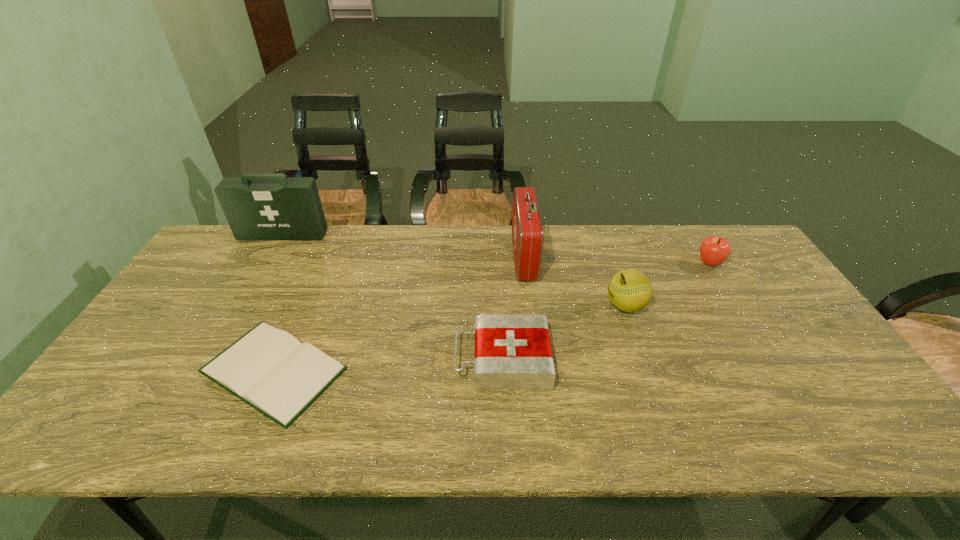
You are a GUI agent. You are given a task and a screenshot of the screen. Output one action in this format:
    pyautogui.click(x=<x>, y=<y>)
    Task: Click on the leftmost first-aid kit
    The height and width of the screenshot is (540, 960).
    Given the screenshot: What is the action you would take?
    point(258,206)

The image size is (960, 540). I want to click on softball, so click(629, 290).

At what (x,y) coordinates should I click in order to perform the action: click on the second object from right to left. Please return your answer as a coordinate pair (x, y). This screenshot has height=540, width=960. Looking at the image, I should click on (629, 290).

Locate an element on the screen. The height and width of the screenshot is (540, 960). the rightmost object is located at coordinates (714, 250).

Identify the location of the second shortest object. (512, 351).

The height and width of the screenshot is (540, 960). I want to click on the shortest first-aid kit, so click(x=512, y=351).

Image resolution: width=960 pixels, height=540 pixels. In order to click on the shortest object in this screenshot , I will do pos(269,369).

Locate an element on the screen. The height and width of the screenshot is (540, 960). vacant area situated 0.110m on the front-facing side of the leftmost first-aid kit is located at coordinates (268, 261).

Find the location of a particular element. This screenshot has height=540, width=960. vacant space located on the logo side of the third nearest object is located at coordinates (525, 306).

The height and width of the screenshot is (540, 960). Identify the location of free location located on the logo side of the third nearest object. (539, 306).